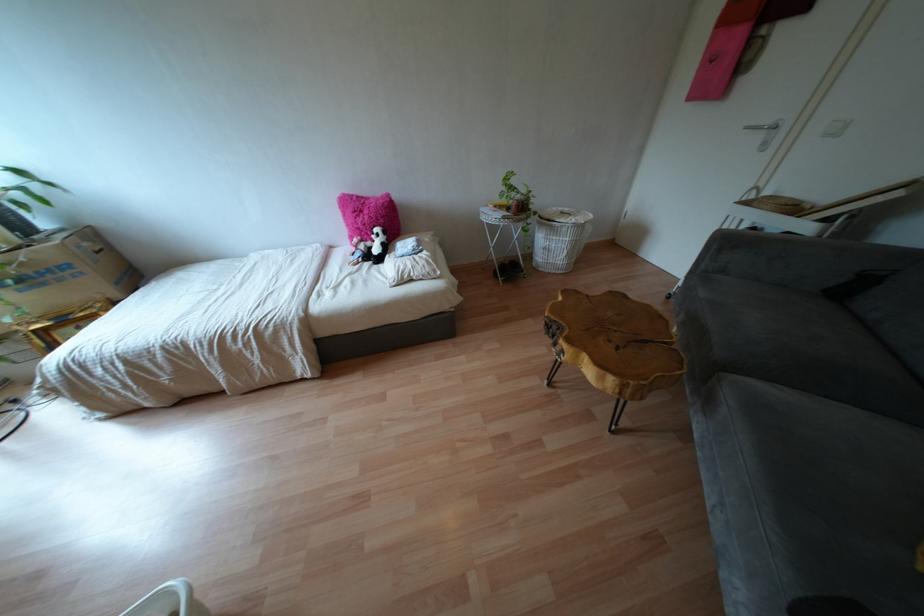
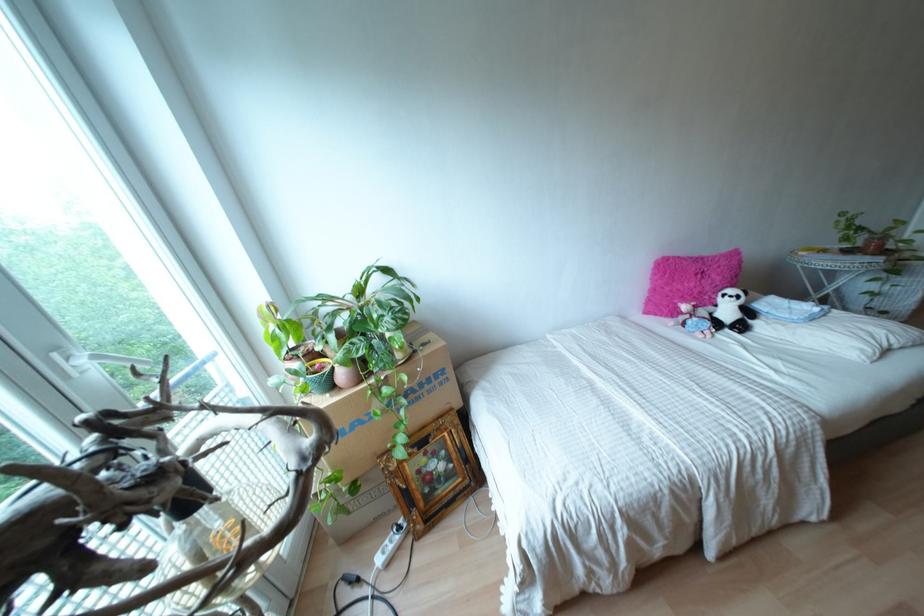
Locate, in the second image, the point that corresponds to point 368,243 in the first image.

(710, 308)